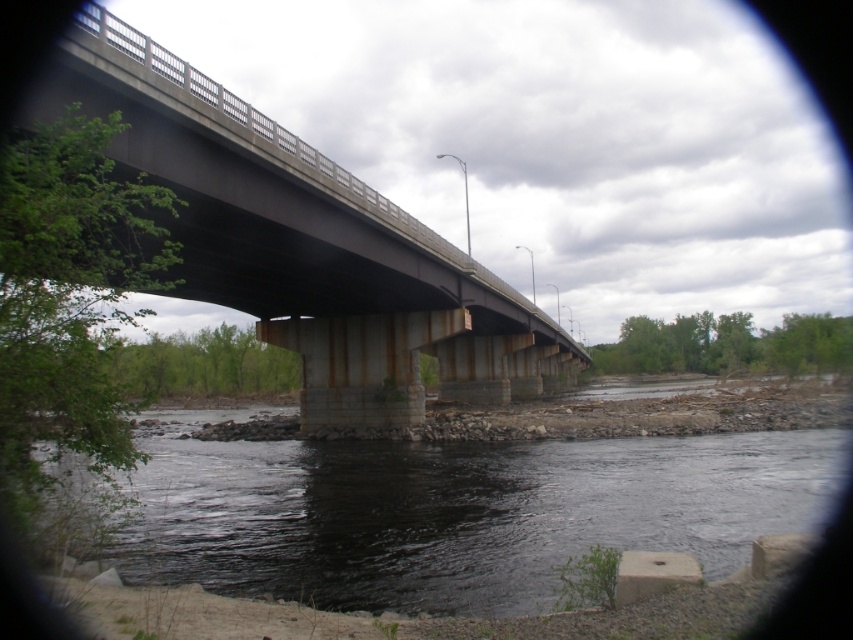
Question: Which object is farther from the camera taking this photo?

Choices:
 (A) black water at lower center
 (B) concrete bridge at center

Answer: (B)

Question: Does black water at lower center appear on the left side of concrete bridge at center?

Choices:
 (A) yes
 (B) no

Answer: (A)

Question: Can you confirm if black water at lower center is positioned below concrete bridge at center?

Choices:
 (A) yes
 (B) no

Answer: (B)

Question: Where is black water at lower center located in relation to concrete bridge at center in the image?

Choices:
 (A) right
 (B) left

Answer: (B)